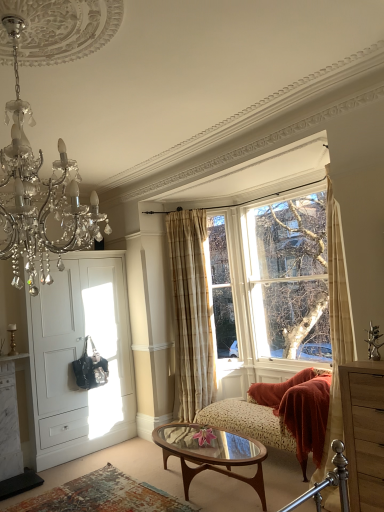
Question: Can you confirm if wooden dresser at right is positioned to the left of translucent glass coffee table at center?

Choices:
 (A) yes
 (B) no

Answer: (B)

Question: Could you tell me if wooden dresser at right is facing translucent glass coffee table at center?

Choices:
 (A) no
 (B) yes

Answer: (A)

Question: Considering the relative sizes of wooden dresser at right and translucent glass coffee table at center in the image provided, is wooden dresser at right taller than translucent glass coffee table at center?

Choices:
 (A) no
 (B) yes

Answer: (B)

Question: Would you say wooden dresser at right is a long distance from translucent glass coffee table at center?

Choices:
 (A) yes
 (B) no

Answer: (A)

Question: From the image's perspective, would you say wooden dresser at right is shown under translucent glass coffee table at center?

Choices:
 (A) yes
 (B) no

Answer: (B)

Question: Is the depth of wooden dresser at right greater than that of translucent glass coffee table at center?

Choices:
 (A) no
 (B) yes

Answer: (A)

Question: Considering the relative sizes of clear glass window at upper right and translucent glass coffee table at center in the image provided, is clear glass window at upper right shorter than translucent glass coffee table at center?

Choices:
 (A) yes
 (B) no

Answer: (B)

Question: Does clear glass window at upper right turn towards translucent glass coffee table at center?

Choices:
 (A) no
 (B) yes

Answer: (B)

Question: Can you confirm if clear glass window at upper right is wider than translucent glass coffee table at center?

Choices:
 (A) yes
 (B) no

Answer: (B)

Question: Does clear glass window at upper right have a lesser width compared to translucent glass coffee table at center?

Choices:
 (A) yes
 (B) no

Answer: (A)

Question: From the image's perspective, is clear glass window at upper right over translucent glass coffee table at center?

Choices:
 (A) no
 (B) yes

Answer: (B)

Question: Can you confirm if clear glass window at upper right is bigger than translucent glass coffee table at center?

Choices:
 (A) yes
 (B) no

Answer: (A)

Question: Is beige plaid curtain at center smaller than white matte door at left?

Choices:
 (A) no
 (B) yes

Answer: (B)